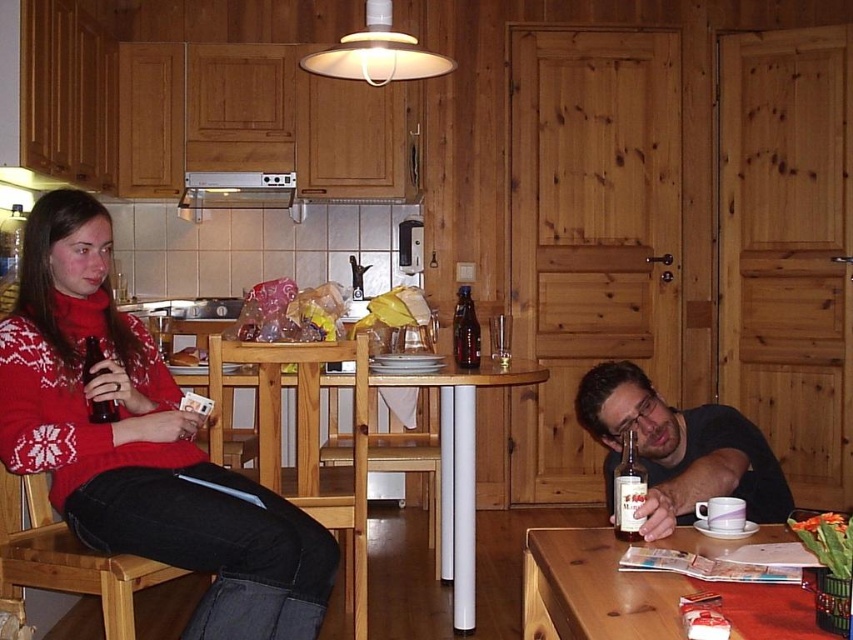
Question: Considering the real-world distances, which object is farthest from the matte red sweater at left?

Choices:
 (A) matte black shirt at lower right
 (B) white plastic table at center

Answer: (A)

Question: Is wooden table at lower right below translucent glass bottle at lower right?

Choices:
 (A) yes
 (B) no

Answer: (A)

Question: Can you confirm if brushed metal exhaust hood at upper center is positioned below translucent glass bottle at lower right?

Choices:
 (A) yes
 (B) no

Answer: (B)

Question: Is wooden table at lower right to the left of translucent glass bottle at lower right from the viewer's perspective?

Choices:
 (A) yes
 (B) no

Answer: (B)

Question: Which object is the farthest from the matte black shirt at lower right?

Choices:
 (A) wooden table at lower right
 (B) brushed metal exhaust hood at upper center

Answer: (B)

Question: Among these points, which one is farthest from the camera?

Choices:
 (A) (592, 372)
 (B) (96, 420)

Answer: (B)